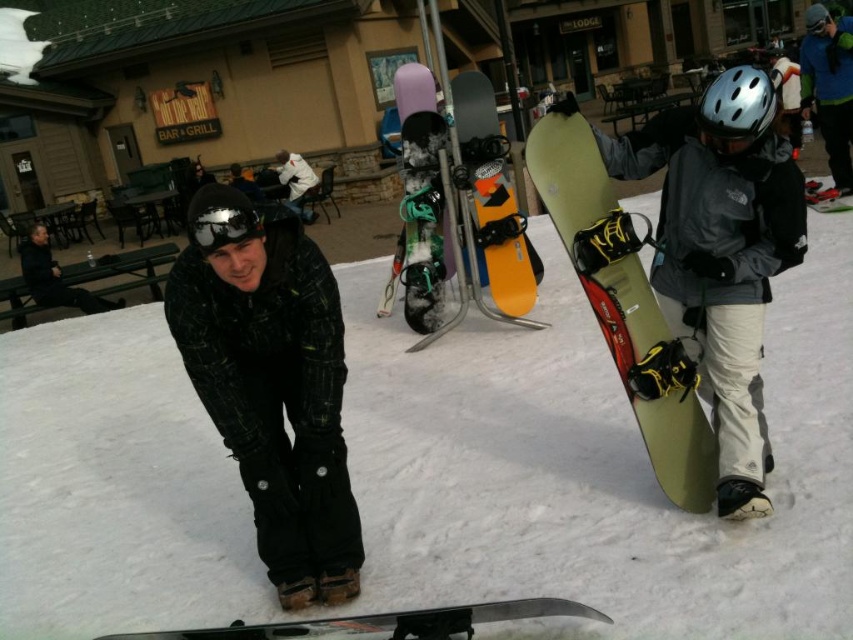
You are a photographer trying to capture both the green matte snowboard at right and the black reflective goggles at center in a single frame. Considering their sizes, which object should you position closer to the camera to ensure both appear balanced in the photo?

The green matte snowboard at right is larger than the black reflective goggles at center. To balance their sizes in the photo, position the smaller black reflective goggles at center closer to the camera while keeping the larger green matte snowboard at right farther away.

You are standing at the point with coordinates point [316,179] and want to walk to the point with coordinates point [635,260]. Which direction should you move?

You should move forward because point [635,260] is in front of point [316,179].

You are planning to carry both the green matte snowboard at right and the white matte jacket at upper center in a backpack. Which item will require more space horizontally?

The white matte jacket at upper center requires more horizontal space because its width is greater than the green matte snowboard at right.